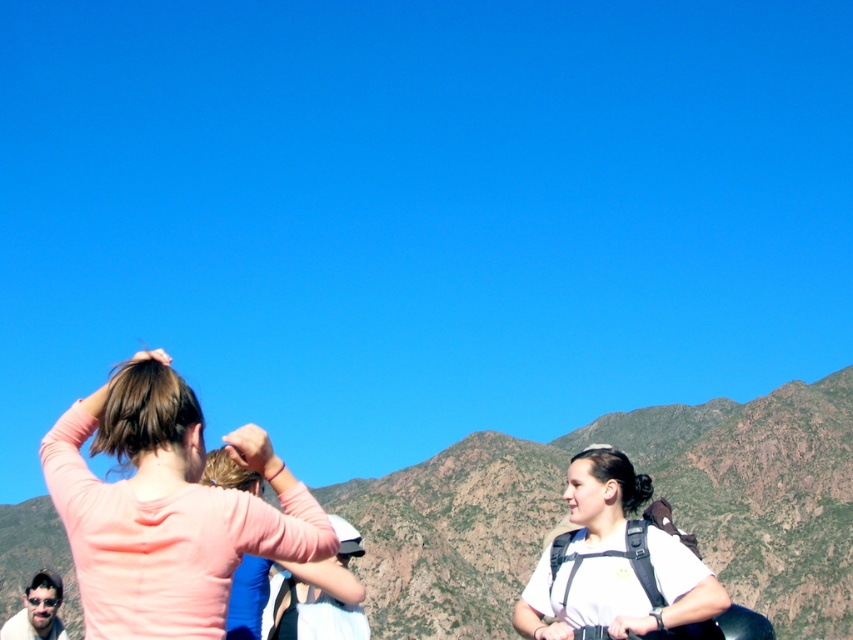
You are a photographer trying to capture a photo of the two people in the scene. You want to ensure both the pink matte shirt at upper left and the white matte backpack at center are clearly visible in your shot. Based on their positions, which direction should you move to frame them properly?

The pink matte shirt at upper left is to the left of the white matte backpack at center, so moving to the right side might help frame both objects in the shot.

You are planning to take a photo of the green textured mountain at center and the white matte backpack at center. Which object should you focus on first if you want to capture both in the same frame?

You should focus on the green textured mountain at center first because it is larger in size than the white matte backpack at center, ensuring it is properly in focus while the backpack remains in the background.